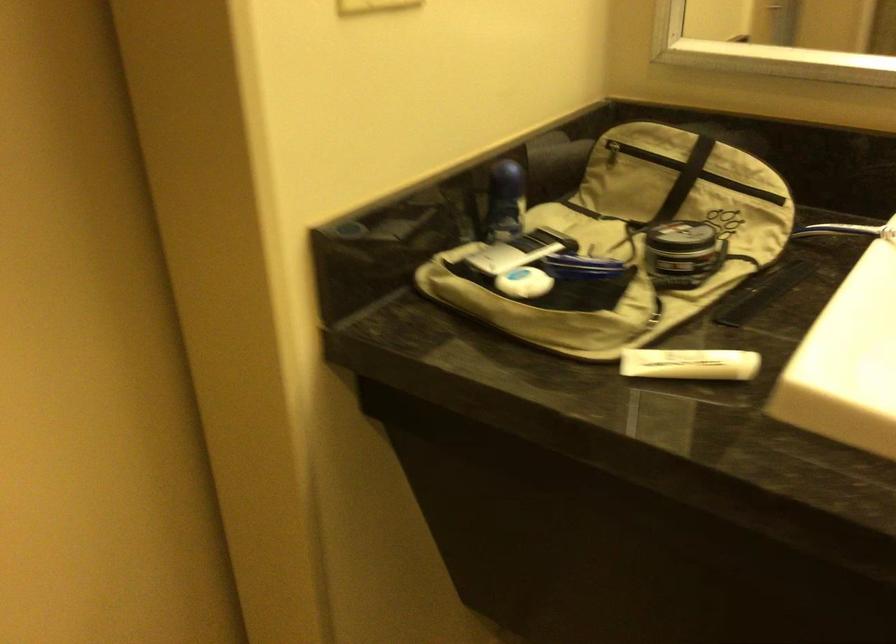
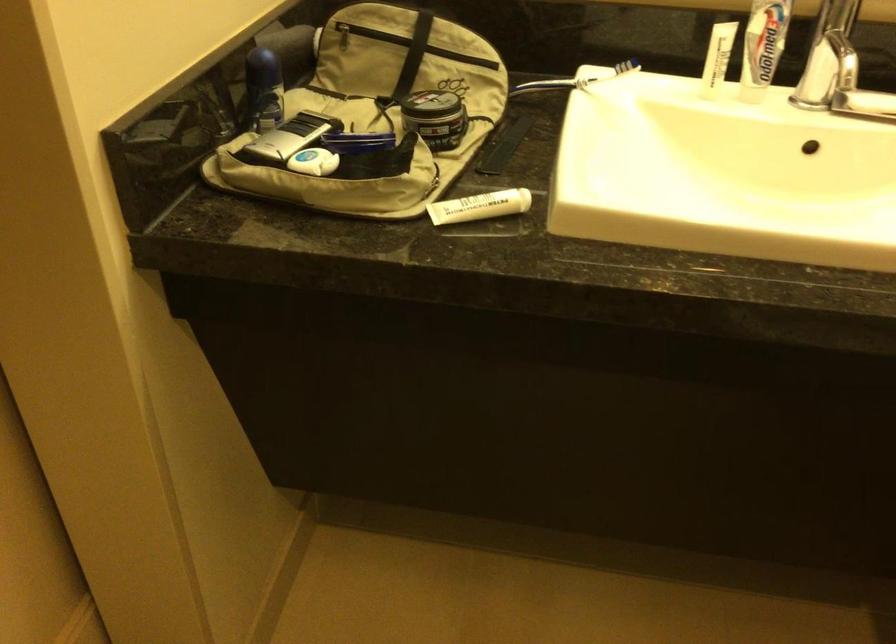
In the second image, find the point that corresponds to point (762, 294) in the first image.

(503, 146)